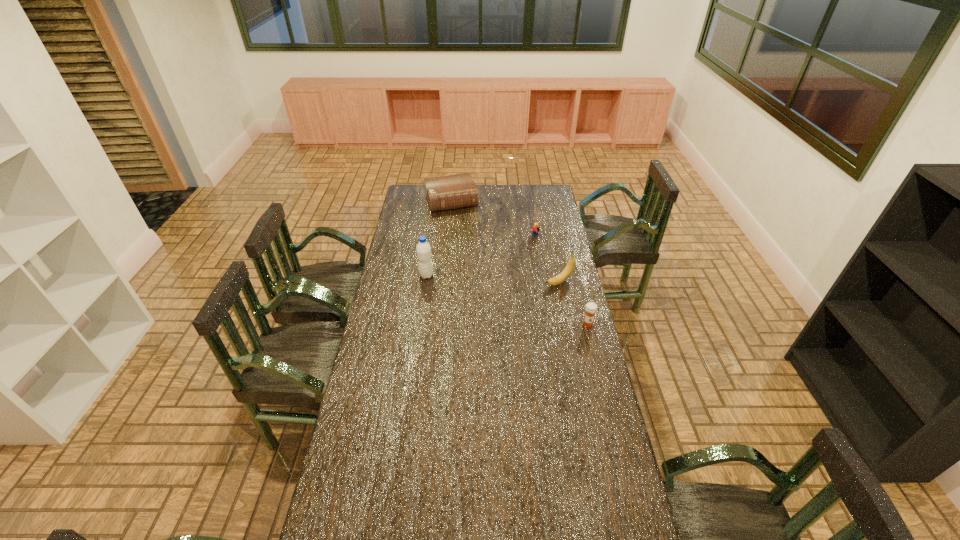
Where is `free space on the desktop that is between the tallest object and the nearest object and is positioned on the front-facing side of the Lego`? The width and height of the screenshot is (960, 540). free space on the desktop that is between the tallest object and the nearest object and is positioned on the front-facing side of the Lego is located at coordinates (493, 296).

Locate an element on the screen. Image resolution: width=960 pixels, height=540 pixels. vacant space on the desktop that is between the tallest object and the nearest object and is positioned at the start of the peel on the banana is located at coordinates (519, 303).

Find the location of a particular element. Image resolution: width=960 pixels, height=540 pixels. free space on the desktop that is between the tallest object and the medicine and is positioned on the spine side of the Bible is located at coordinates (487, 294).